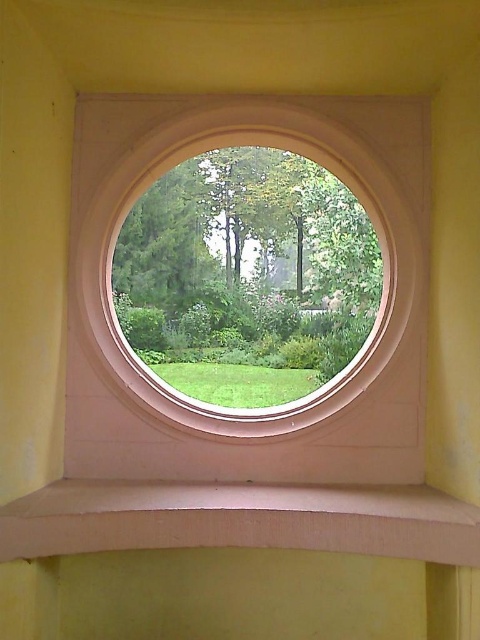
You are an interior designer planning to place a decorative plant pot on the smooth beige ledge at lower center. Considering the size of the white smooth window frame at center, will the plant pot fit on the ledge without blocking the window view?

The white smooth window frame at center is larger than the smooth beige ledge at lower center. Since the ledge is smaller, placing a decorative plant pot on it might block the window view if the pot is too large. Choose a smaller pot to ensure it doesn

Based on the photo, you are a painter standing on the smooth beige ledge at lower center, looking towards the white smooth window frame at center. Which object is closer to you?

The smooth beige ledge at lower center is closer to you since you are standing on it, while the white smooth window frame at center is in front of the ledge, making it farther away.

You are an interior designer planning to place a decorative vase on the smooth beige ledge at lower center. The vase is 10 cm tall. Considering the height of the white smooth window frame at center, will the vase be visible from the garden outside?

The white smooth window frame at center is much taller than the smooth beige ledge at lower center. Since the vase is only 10 cm tall, it might be partially or fully obscured by the window frame, making it less visible from the garden outside.